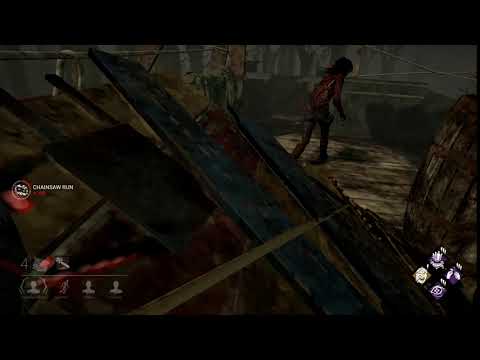
Where is `dirty floor the image is standing on`? The width and height of the screenshot is (480, 360). dirty floor the image is standing on is located at coordinates (367, 155), (377, 200).